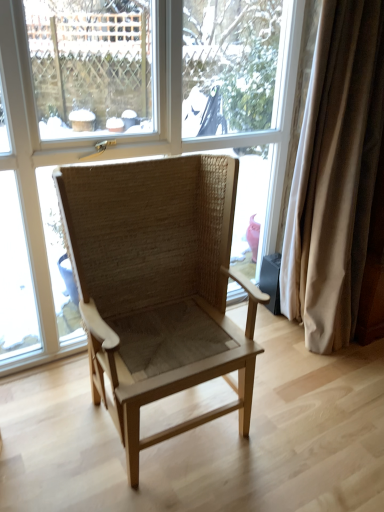
You are a GUI agent. You are given a task and a screenshot of the screen. Output one action in this format:
    pyautogui.click(x=<x>, y=<y>)
    Task: Click on the vacant area that is in front of beige fabric curtain at right
    This screenshot has height=512, width=384.
    Given the screenshot: What is the action you would take?
    pyautogui.click(x=327, y=377)